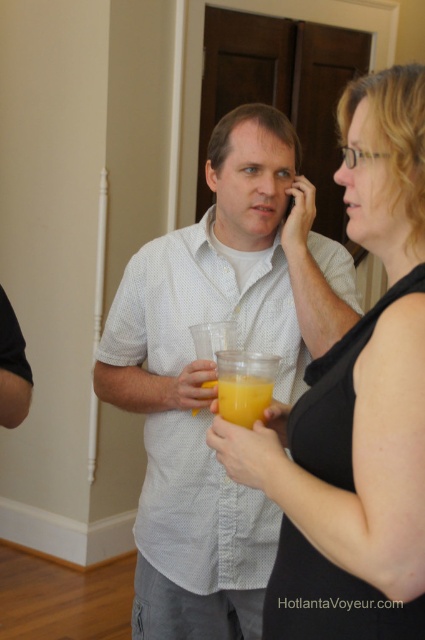
Question: Is black matte tank top at center positioned in front of translucent plastic cup at center?

Choices:
 (A) yes
 (B) no

Answer: (A)

Question: Which object is the closest to the black matte tank top at center?

Choices:
 (A) translucent plastic cup at center
 (B) white dotted shirt at center

Answer: (A)

Question: Which of the following is the closest to the observer?

Choices:
 (A) translucent plastic cup at center
 (B) black matte tank top at center
 (C) white dotted shirt at center

Answer: (B)

Question: Which of the following is the closest to the observer?

Choices:
 (A) black matte tank top at center
 (B) white dotted shirt at center
 (C) translucent plastic cup at center

Answer: (A)

Question: In this image, where is white dotted shirt at center located relative to black matte tank top at center?

Choices:
 (A) left
 (B) right

Answer: (A)

Question: Is the position of white dotted shirt at center less distant than that of black matte tank top at center?

Choices:
 (A) yes
 (B) no

Answer: (B)